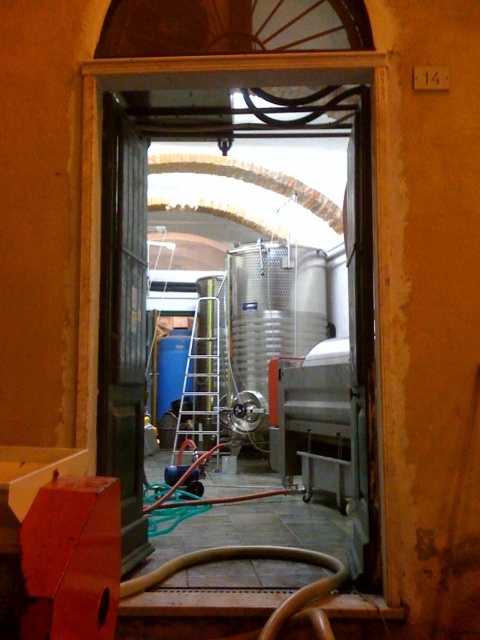
Is point (108, 394) closer to viewer compared to point (215, 392)?

Yes, point (108, 394) is closer to viewer.

Can you confirm if black wooden door at left is wider than silver metallic ladder at center?

Incorrect, black wooden door at left's width does not surpass silver metallic ladder at center's.

Is point (128, 268) positioned behind point (201, 388)?

No.

The width and height of the screenshot is (480, 640). I want to click on black wooden door at left, so click(122, 323).